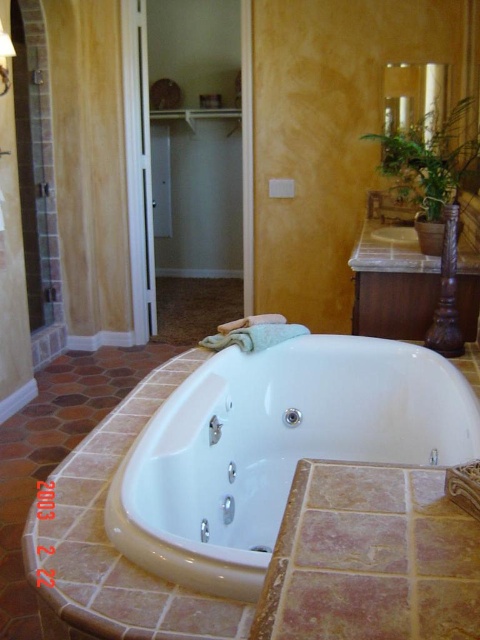
Question: Does white glossy bathtub at center have a greater width compared to white glossy sink at center?

Choices:
 (A) yes
 (B) no

Answer: (A)

Question: Among these points, which one is farthest from the camera?

Choices:
 (A) 414,227
 (B) 243,433

Answer: (A)

Question: Does white glossy bathtub at center come behind white glossy sink at center?

Choices:
 (A) yes
 (B) no

Answer: (B)

Question: Which of the following is the closest to the observer?

Choices:
 (A) (399, 365)
 (B) (415, 230)

Answer: (A)

Question: Can you confirm if white glossy bathtub at center is smaller than white glossy sink at center?

Choices:
 (A) yes
 (B) no

Answer: (B)